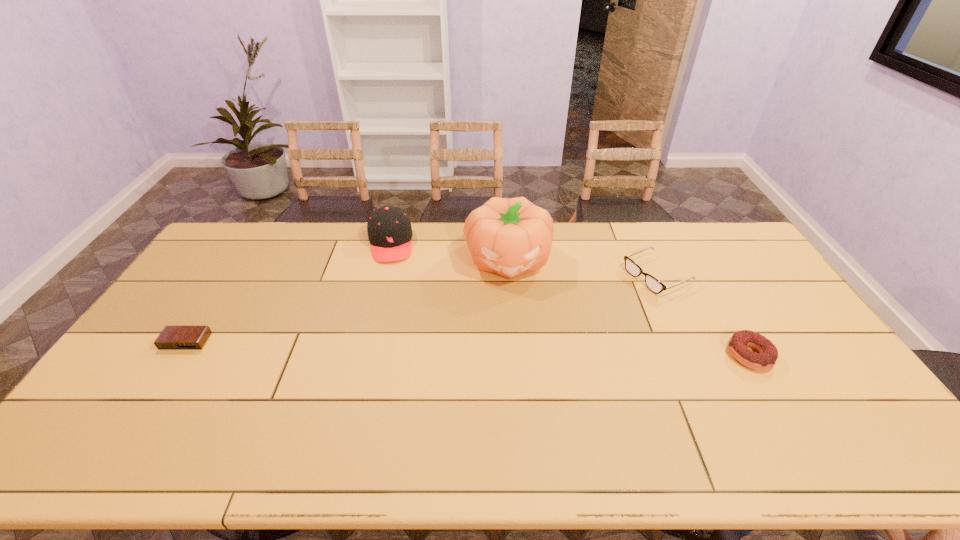
Where is `the third closest object to the third object from right to left`? The height and width of the screenshot is (540, 960). the third closest object to the third object from right to left is located at coordinates (737, 345).

Identify which object is the nearest to the second tallest object. Please provide its 2D coordinates. Your answer should be formatted as a tuple, i.e. [(x, y)], where the tuple contains the x and y coordinates of a point satisfying the conditions above.

[(509, 237)]

You are a GUI agent. You are given a task and a screenshot of the screen. Output one action in this format:
    pyautogui.click(x=<x>, y=<y>)
    Task: Click on the vacant space that satisfies the following two spatial constraints: 1. on the front face of the leftmost object; 2. on the right side of the doughnut
    
    Given the screenshot: What is the action you would take?
    pyautogui.click(x=177, y=355)